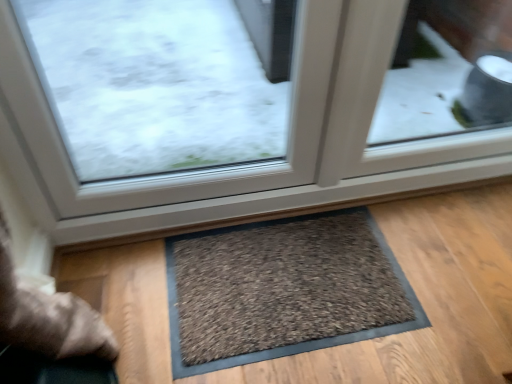
Where is `brown textured mat at center`? brown textured mat at center is located at coordinates (283, 290).

The image size is (512, 384). What do you see at coordinates (283, 290) in the screenshot?
I see `brown textured mat at center` at bounding box center [283, 290].

Where is `brown textured mat at center`? Image resolution: width=512 pixels, height=384 pixels. brown textured mat at center is located at coordinates (283, 290).